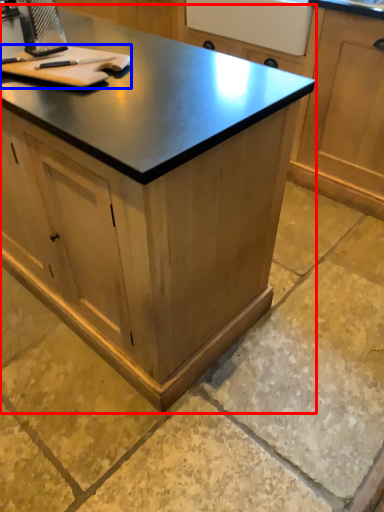
Question: Among these objects, which one is farthest to the camera, cabinetry (highlighted by a red box) or cutting board (highlighted by a blue box)?

Choices:
 (A) cabinetry
 (B) cutting board

Answer: (B)